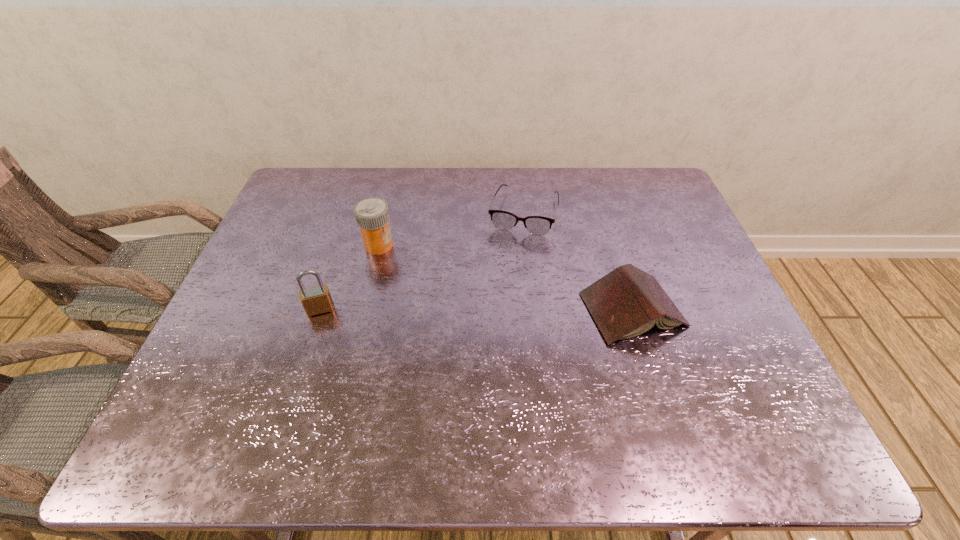
Where is `vacant space situated 0.170m on the face of the third object from left to right`? Image resolution: width=960 pixels, height=540 pixels. vacant space situated 0.170m on the face of the third object from left to right is located at coordinates (506, 277).

Find the location of a particular element. This screenshot has height=540, width=960. vacant space located 0.090m on the face of the third object from left to right is located at coordinates (512, 257).

Locate an element on the screen. object situated at the far edge is located at coordinates (538, 225).

You are a GUI agent. You are given a task and a screenshot of the screen. Output one action in this format:
    pyautogui.click(x=<x>, y=<y>)
    Task: Click on the object located at the right edge
    
    Given the screenshot: What is the action you would take?
    pyautogui.click(x=627, y=302)

Locate an element on the screen. The height and width of the screenshot is (540, 960). free space at the far edge of the desktop is located at coordinates (385, 183).

Identify the location of free spot at the near edge of the desktop. This screenshot has width=960, height=540. (541, 403).

Locate an element on the screen. free space at the left edge is located at coordinates (272, 240).

The width and height of the screenshot is (960, 540). I want to click on blank space at the right edge of the desktop, so click(716, 340).

Where is `free space at the far left corner of the desktop`? free space at the far left corner of the desktop is located at coordinates 313,182.

Locate an element on the screen. empty location between the spectacles and the rightmost object is located at coordinates (578, 261).